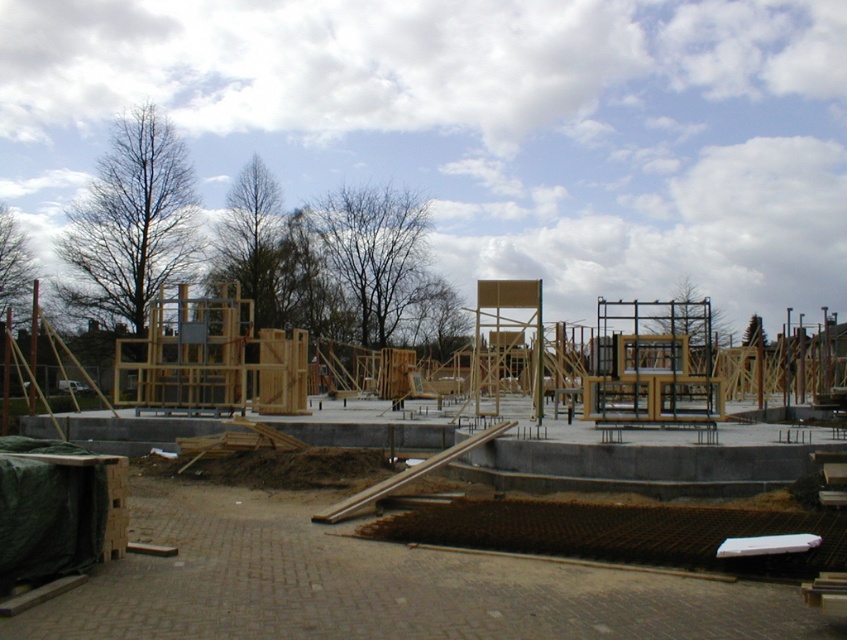
Question: Is natural wood construction at center positioned behind gray concrete foundation at center?

Choices:
 (A) no
 (B) yes

Answer: (A)

Question: Does natural wood construction at center have a larger size compared to gray concrete foundation at center?

Choices:
 (A) no
 (B) yes

Answer: (A)

Question: Is natural wood construction at center thinner than gray concrete foundation at center?

Choices:
 (A) no
 (B) yes

Answer: (B)

Question: Which object appears closest to the camera in this image?

Choices:
 (A) gray concrete foundation at center
 (B) natural wood construction at center

Answer: (B)

Question: Which of the following is the farthest from the observer?

Choices:
 (A) (696, 612)
 (B) (693, 476)

Answer: (B)